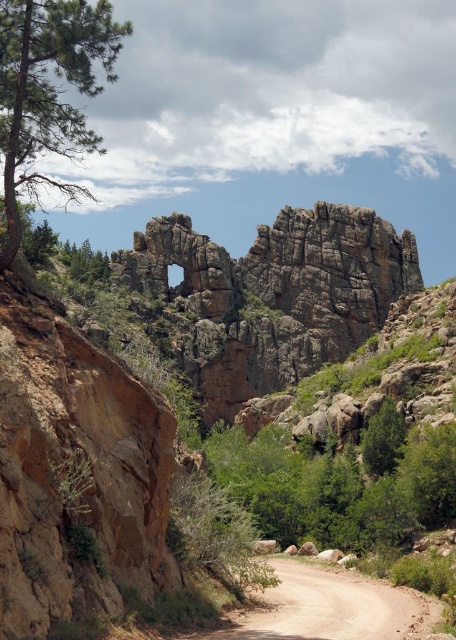
Question: Which of these objects is positioned closest to the green leafy tree at center?

Choices:
 (A) green matte tree at left
 (B) brown dirt track at center

Answer: (B)

Question: Can you confirm if green leafy tree at center is positioned below brown dirt track at center?

Choices:
 (A) yes
 (B) no

Answer: (B)

Question: Among these objects, which one is nearest to the camera?

Choices:
 (A) green matte tree at left
 (B) green leafy tree at center

Answer: (A)

Question: Considering the relative positions of green leafy tree at center and brown dirt track at center in the image provided, where is green leafy tree at center located with respect to brown dirt track at center?

Choices:
 (A) below
 (B) above

Answer: (B)

Question: Is green leafy tree at center below brown dirt track at center?

Choices:
 (A) no
 (B) yes

Answer: (A)

Question: Based on their relative distances, which object is farther from the green leafy tree at center?

Choices:
 (A) green matte tree at left
 (B) brown dirt track at center

Answer: (A)